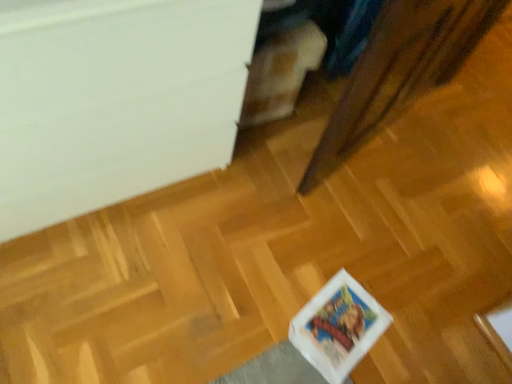
Image resolution: width=512 pixels, height=384 pixels. What do you see at coordinates (115, 101) in the screenshot? I see `white matte drawer at lower left` at bounding box center [115, 101].

This screenshot has height=384, width=512. In order to click on white matte drawer at lower left in this screenshot , I will do `click(115, 101)`.

What are the coordinates of `white matte drawer at lower left` in the screenshot? It's located at tap(115, 101).